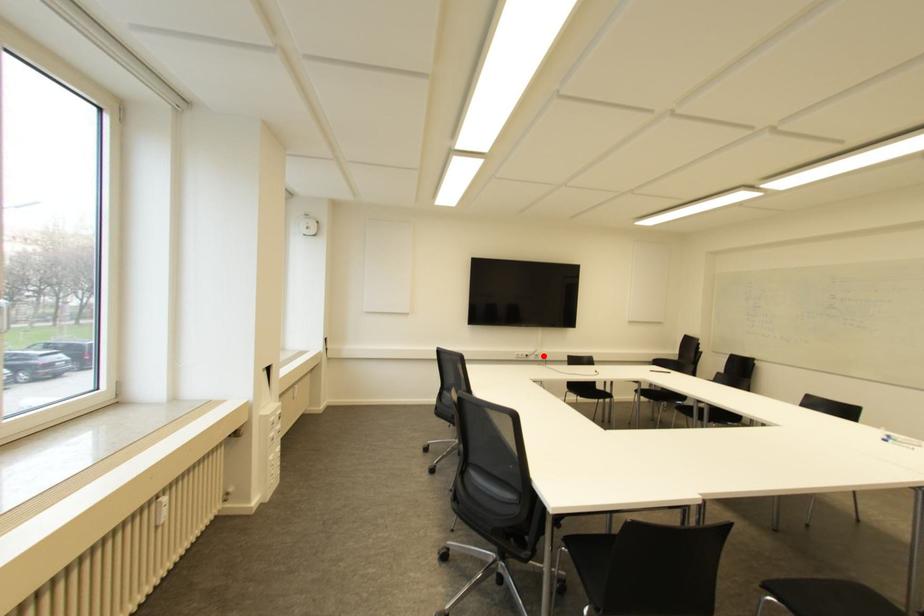
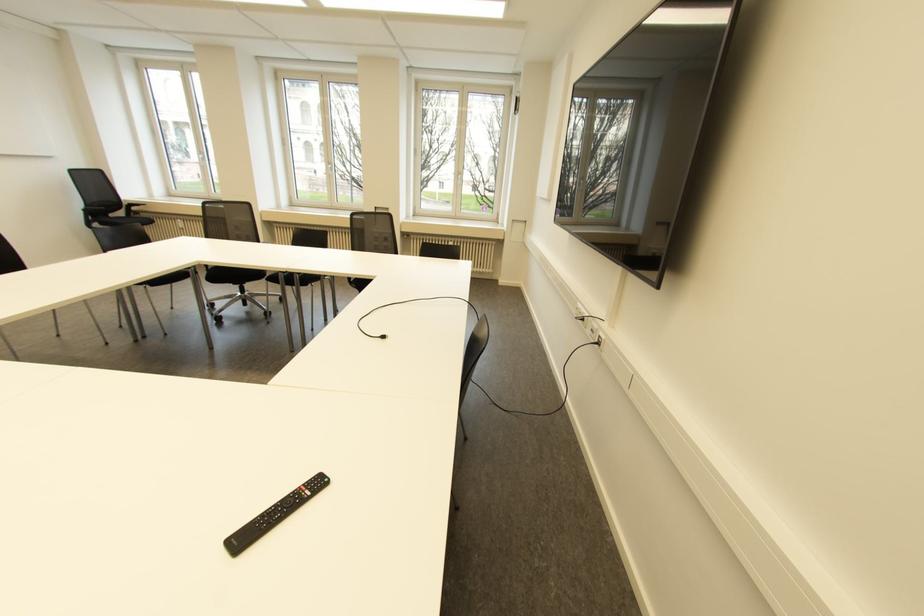
Question: A red point is marked in image1. In image2, is the corresponding 3D point closer to the camera or farther? Reply with the corresponding letter.

Choices:
 (A) The corresponding 3D point is closer.
 (B) The corresponding 3D point is farther.

Answer: (A)